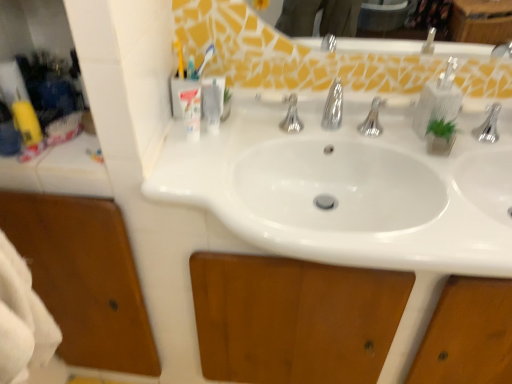
Identify the location of empty space that is to the right of clear plastic soap dispenser at upper center, placed as the first toiletry when sorted from right to left. (269, 134).